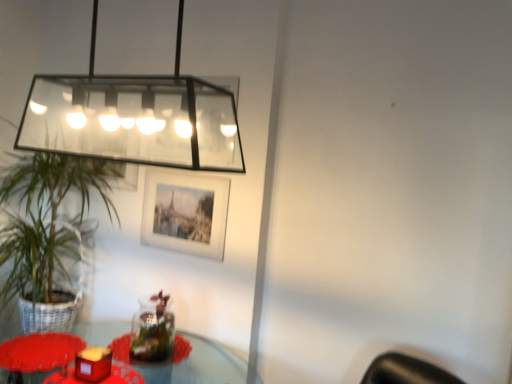
Question: Would you say clear glass rectangular light fixture at upper left is to the left or to the right of translucent glass table at lower left in the picture?

Choices:
 (A) left
 (B) right

Answer: (B)

Question: Considering the positions of clear glass rectangular light fixture at upper left and translucent glass table at lower left in the image, is clear glass rectangular light fixture at upper left wider or thinner than translucent glass table at lower left?

Choices:
 (A) wide
 (B) thin

Answer: (B)

Question: Considering the real-world distances, which object is farthest from the green leafy plant at left?

Choices:
 (A) matte white picture frame at center
 (B) matte red candle at lower left
 (C) clear glass rectangular light fixture at upper left
 (D) matte red candle holder at lower left
 (E) translucent glass table at lower left

Answer: (E)

Question: Which object is positioned closest to the clear glass rectangular light fixture at upper left?

Choices:
 (A) matte red candle holder at lower left
 (B) green leafy plant at left
 (C) matte red candle at lower left
 (D) translucent glass table at lower left
 (E) matte white picture frame at center

Answer: (E)